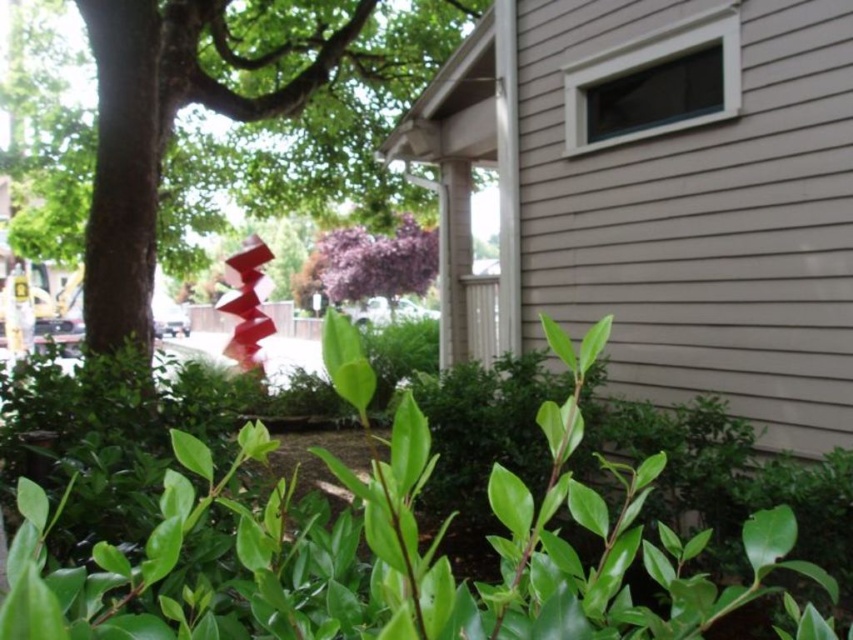
You are standing in the suburban scene and notice both the green leafy tree at center and the purple matte flower at center. Which object is positioned lower in the image?

The green leafy tree at center is located below the purple matte flower at center, so it is positioned lower in the image.

You are a gardener planning to plant a new row of flowers. You have a space that can accommodate either the green glossy hedge at lower center or the purple matte flower at center. Based on their sizes, which one would you choose if you want to fill the space more effectively?

The green glossy hedge at lower center has a larger width than the purple matte flower at center, so it would fill the space more effectively.